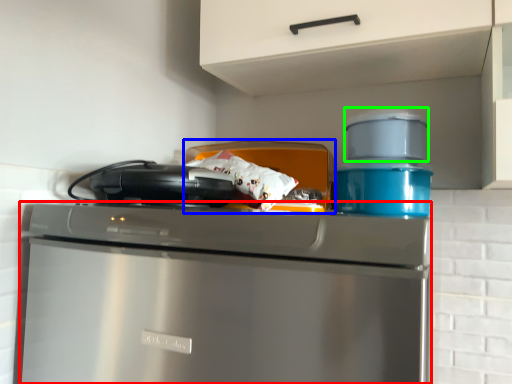
Question: Which object is positioned farthest from home appliance (highlighted by a red box)? Select from appliance (highlighted by a blue box) and appliance (highlighted by a green box).

Choices:
 (A) appliance
 (B) appliance

Answer: (B)